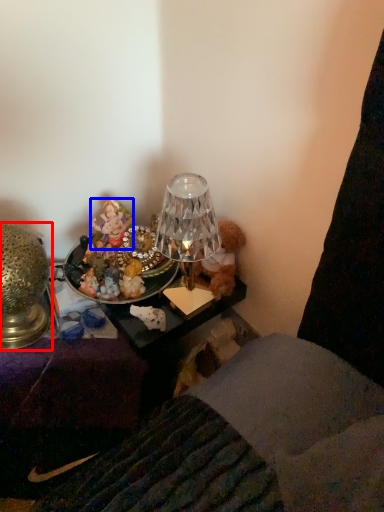
Question: Among these objects, which one is farthest to the camera, lamp (highlighted by a red box) or person (highlighted by a blue box)?

Choices:
 (A) lamp
 (B) person

Answer: (B)